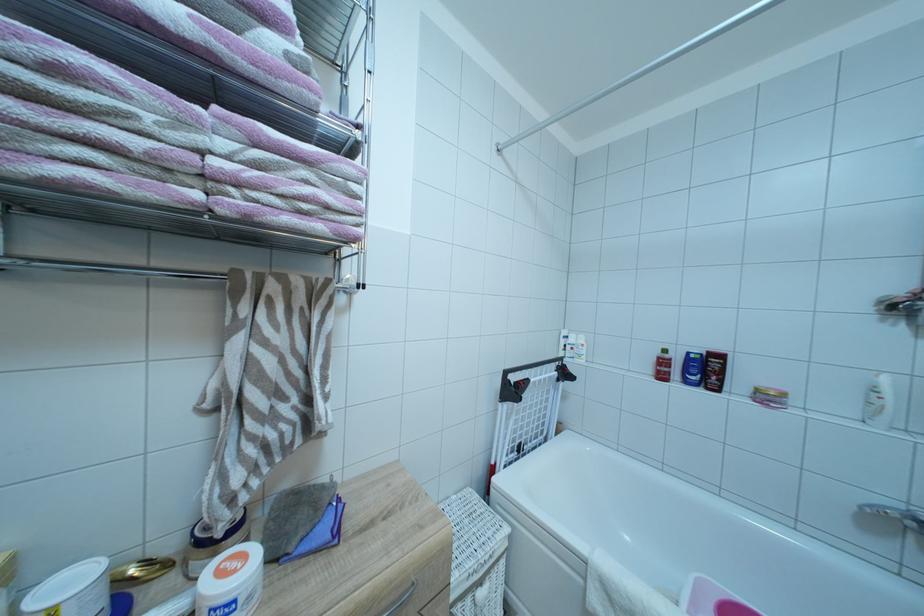
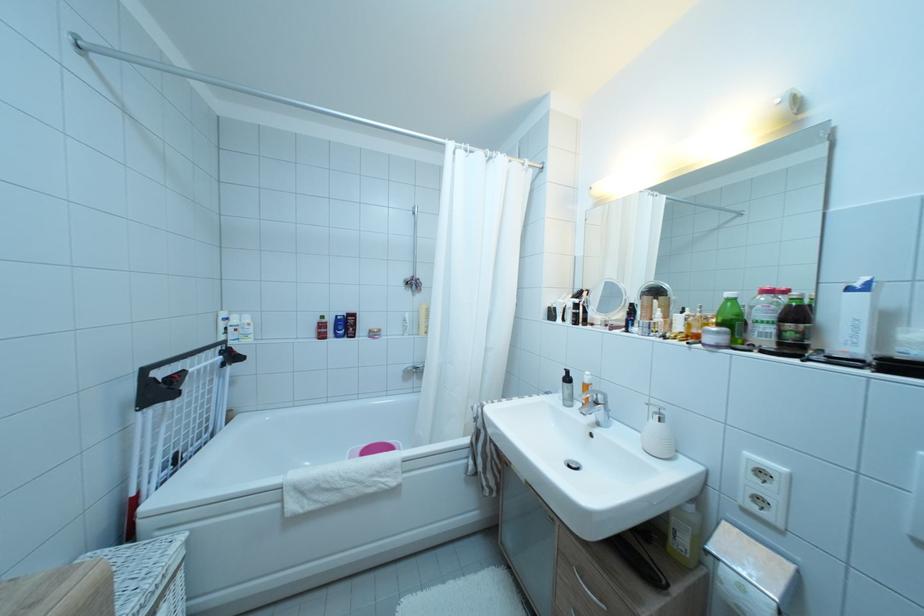
Question: The images are taken continuously from a first-person perspective. In which direction is your viewpoint rotating?

Choices:
 (A) Left
 (B) Right
 (C) Up
 (D) Down

Answer: (B)